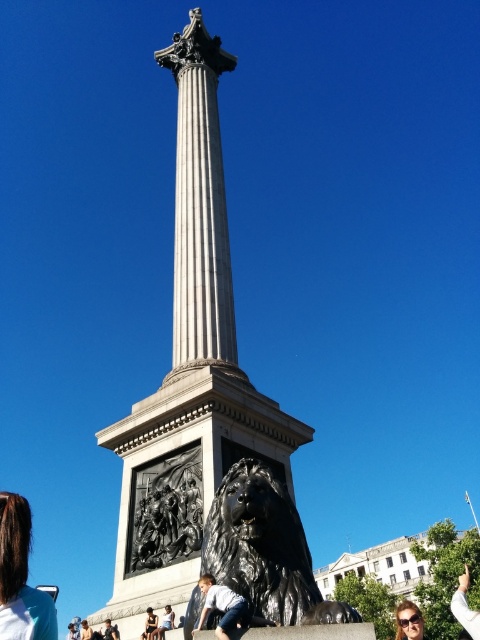
You are standing at the monument and want to take a photo of the lion statue without anyone in the foreground. The dark blue jeans at lower center are blocking your view. Where should you move to avoid them?

Move to the left or right of the dark blue jeans at lower center since their position is at point (149, 625), which is near the lower center. By shifting laterally, you can position yourself to frame the lion statue without the obstruction.

You are a tourist visiting the monument and want to take a photo of the dark gray metallic relief at center and the matte black sunglasses at lower right. Which object should you focus on first if you want to capture both in one frame without moving the camera?

You should focus on the dark gray metallic relief at center first because it is shorter than the matte black sunglasses at lower right, so it will be closer to the camera and easier to include in the frame.

You are standing in front of the monument and want to take a photo of the dark gray metallic relief at center. If your camera can focus on objects up to 100 feet away, will you be able to capture a clear image of the relief?

The dark gray metallic relief at center is 87.18 feet away from the viewer. Since the camera can focus up to 100 feet, the distance is within range, so yes, you can capture a clear image of the relief.